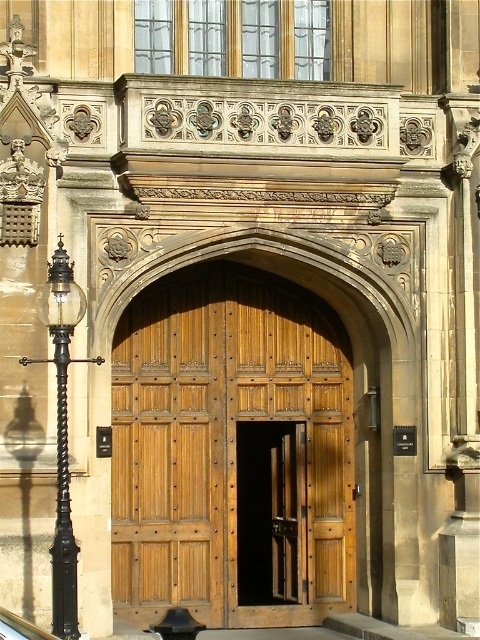
Question: Which of the following is the closest to the observer?

Choices:
 (A) (312, 540)
 (B) (20, 636)

Answer: (B)

Question: Can you confirm if black glass lamp post at left is positioned to the left of black glass car at lower left?

Choices:
 (A) no
 (B) yes

Answer: (A)

Question: Which of the following is the closest to the observer?

Choices:
 (A) wooden panelled door at center
 (B) black glass lamp post at left
 (C) black glass car at lower left

Answer: (C)

Question: Is wooden panelled door at center wider than black glass car at lower left?

Choices:
 (A) yes
 (B) no

Answer: (A)

Question: Based on their relative distances, which object is farther from the black glass lamp post at left?

Choices:
 (A) wooden panelled door at center
 (B) black glass car at lower left

Answer: (A)

Question: Is wooden panelled door at center closer to camera compared to black glass lamp post at left?

Choices:
 (A) yes
 (B) no

Answer: (B)